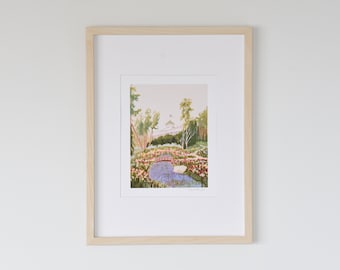
Find the location of a particular element. Image resolution: width=340 pixels, height=270 pixels. white matte aroundn painting is located at coordinates (103, 140), (159, 57), (232, 137), (167, 216).